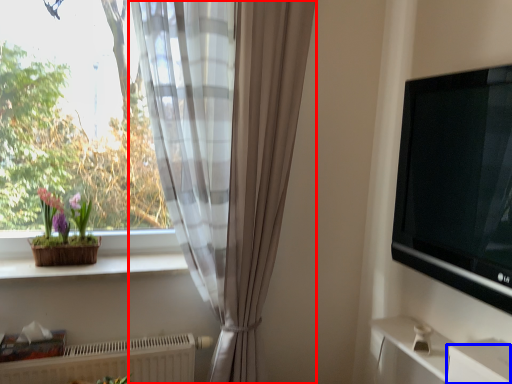
Question: Among these objects, which one is nearest to the camera, curtain (highlighted by a red box) or drawer (highlighted by a blue box)?

Choices:
 (A) curtain
 (B) drawer

Answer: (B)